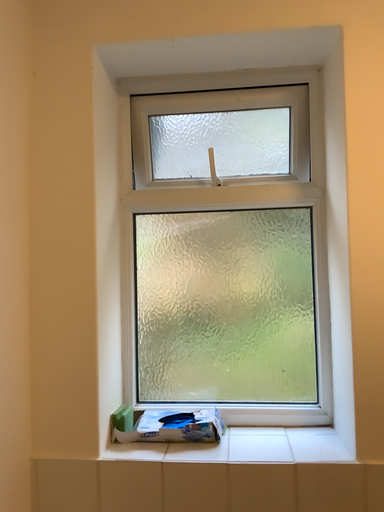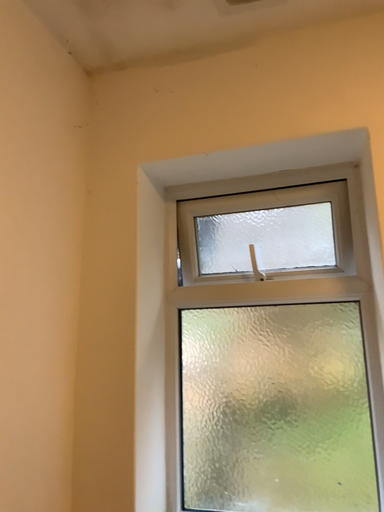
Question: Which way did the camera rotate in the video?

Choices:
 (A) rotated upward
 (B) rotated downward

Answer: (A)